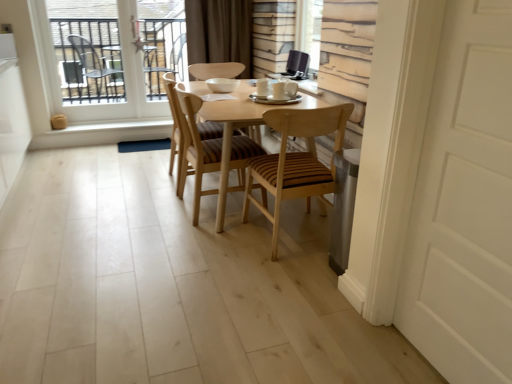
Question: From a real-world perspective, is wooden striped chair at center, the 1th chair when ordered from right to left, on brown fabric curtain at upper center?

Choices:
 (A) no
 (B) yes

Answer: (A)

Question: From a real-world perspective, is wooden striped chair at center, the 1th chair when ordered from right to left, physically below brown fabric curtain at upper center?

Choices:
 (A) yes
 (B) no

Answer: (A)

Question: Is wooden striped chair at center, marked as the third chair in a left-to-right arrangement, positioned in front of brown fabric curtain at upper center?

Choices:
 (A) yes
 (B) no

Answer: (A)

Question: From the image's perspective, is wooden striped chair at center, the 1th chair when ordered from right to left, on top of brown fabric curtain at upper center?

Choices:
 (A) no
 (B) yes

Answer: (A)

Question: Is wooden striped chair at center, marked as the third chair in a left-to-right arrangement, with brown fabric curtain at upper center?

Choices:
 (A) yes
 (B) no

Answer: (B)

Question: Does wooden striped chair at center, the 1th chair when ordered from right to left, have a smaller size compared to brown fabric curtain at upper center?

Choices:
 (A) yes
 (B) no

Answer: (B)

Question: Are woodenchair at center, placed as the 2th chair when sorted from left to right, and clear glass window at upper left far apart?

Choices:
 (A) no
 (B) yes

Answer: (B)

Question: From the image's perspective, is woodenchair at center, placed as the 2th chair when sorted from left to right, over clear glass window at upper left?

Choices:
 (A) no
 (B) yes

Answer: (A)

Question: Is woodenchair at center, the 2th chair from the right, positioned behind clear glass window at upper left?

Choices:
 (A) no
 (B) yes

Answer: (A)

Question: From the image's perspective, is woodenchair at center, the 2th chair from the right, below clear glass window at upper left?

Choices:
 (A) no
 (B) yes

Answer: (B)

Question: Is woodenchair at center, the 2th chair from the right, turned away from clear glass window at upper left?

Choices:
 (A) no
 (B) yes

Answer: (A)

Question: From a real-world perspective, is woodenchair at center, the 2th chair from the right, located beneath clear glass window at upper left?

Choices:
 (A) no
 (B) yes

Answer: (B)

Question: Does clear glass window at upper left have a greater width compared to woodenchair at center, the 2th chair from the right?

Choices:
 (A) no
 (B) yes

Answer: (A)